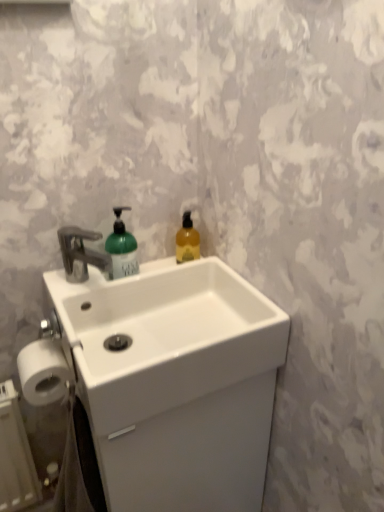
Question: Is white ceramic sink at center wider than white matte toilet paper at lower left?

Choices:
 (A) no
 (B) yes

Answer: (B)

Question: From the image's perspective, is white ceramic sink at center below white matte toilet paper at lower left?

Choices:
 (A) yes
 (B) no

Answer: (B)

Question: Considering the relative sizes of white ceramic sink at center and white matte toilet paper at lower left in the image provided, is white ceramic sink at center shorter than white matte toilet paper at lower left?

Choices:
 (A) no
 (B) yes

Answer: (A)

Question: Is white ceramic sink at center to the right of white matte toilet paper at lower left from the viewer's perspective?

Choices:
 (A) no
 (B) yes

Answer: (B)

Question: Is white ceramic sink at center far away from white matte toilet paper at lower left?

Choices:
 (A) yes
 (B) no

Answer: (B)

Question: Is point (28, 362) closer or farther from the camera than point (180, 259)?

Choices:
 (A) farther
 (B) closer

Answer: (B)

Question: In terms of size, does white matte toilet paper at lower left appear bigger or smaller than translucent amber liquid at upper right, the first bottle in the right-to-left sequence?

Choices:
 (A) small
 (B) big

Answer: (B)

Question: Considering the positions of white matte toilet paper at lower left and translucent amber liquid at upper right, the first bottle in the right-to-left sequence, in the image, is white matte toilet paper at lower left taller or shorter than translucent amber liquid at upper right, the first bottle in the right-to-left sequence,?

Choices:
 (A) short
 (B) tall

Answer: (A)

Question: Is white matte toilet paper at lower left to the left or to the right of translucent amber liquid at upper right, the first bottle in the right-to-left sequence, in the image?

Choices:
 (A) right
 (B) left

Answer: (B)

Question: From a real-world perspective, is translucent amber liquid at upper right, the first bottle in the right-to-left sequence, physically located above or below white ceramic sink at center?

Choices:
 (A) above
 (B) below

Answer: (A)

Question: Is point (183, 238) closer or farther from the camera than point (157, 350)?

Choices:
 (A) farther
 (B) closer

Answer: (A)

Question: From the image's perspective, relative to white ceramic sink at center, is translucent amber liquid at upper right, the first bottle in the right-to-left sequence, above or below?

Choices:
 (A) above
 (B) below

Answer: (A)

Question: Do you think translucent amber liquid at upper right, the first bottle in the right-to-left sequence, is within white ceramic sink at center, or outside of it?

Choices:
 (A) inside
 (B) outside

Answer: (A)

Question: Is translucent amber liquid at upper right, acting as the 2th bottle starting from the left, taller or shorter than green matte bottle at center, arranged as the 2th bottle when viewed from the right?

Choices:
 (A) short
 (B) tall

Answer: (A)

Question: Choose the correct answer: Is translucent amber liquid at upper right, acting as the 2th bottle starting from the left, inside green matte bottle at center, arranged as the 2th bottle when viewed from the right, or outside it?

Choices:
 (A) inside
 (B) outside

Answer: (B)